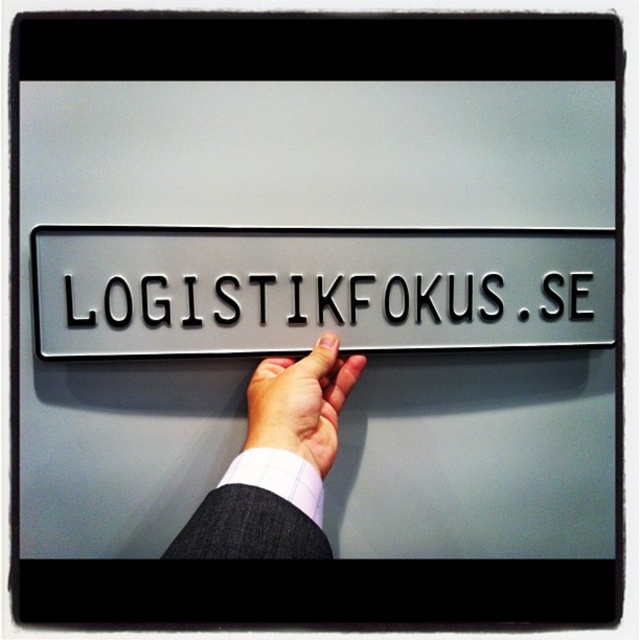
Question: Among these points, which one is farthest from the camera?

Choices:
 (A) (253, 337)
 (B) (310, 496)

Answer: (A)

Question: Which point appears farthest from the camera in this image?

Choices:
 (A) (275, 387)
 (B) (272, 515)

Answer: (A)

Question: Can you confirm if white fabric at center is wider than light skin tone flesh at center?

Choices:
 (A) yes
 (B) no

Answer: (A)

Question: Does white fabric at center lie behind light skin tone flesh at center?

Choices:
 (A) no
 (B) yes

Answer: (A)

Question: Which point is closer to the camera?

Choices:
 (A) (317, 419)
 (B) (294, 419)

Answer: (B)

Question: Does satin silver sign at center appear on the left side of white fabric at center?

Choices:
 (A) yes
 (B) no

Answer: (B)